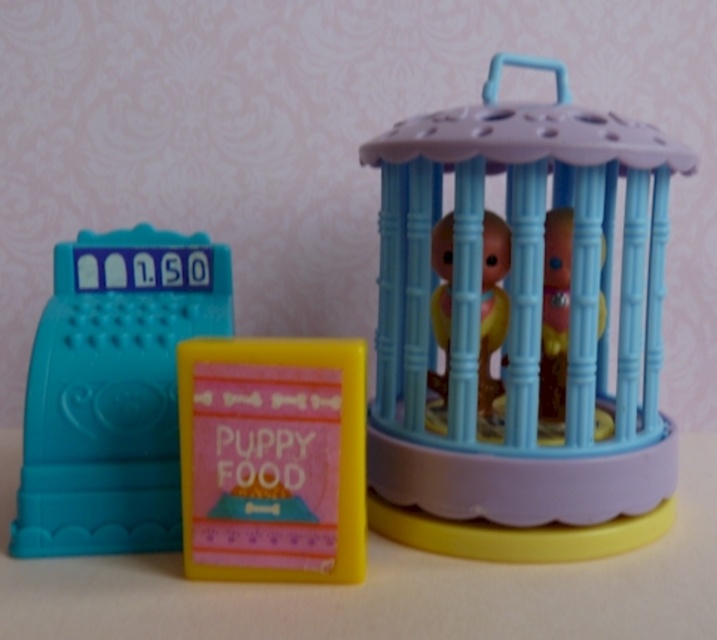
Question: Which of the following is the farthest from the observer?

Choices:
 (A) matte plastic cash register at left
 (B) pastel blue plastic birdcage at right

Answer: (A)

Question: Is matte plastic cash register at left closer to camera compared to yellow matte puppy food at center?

Choices:
 (A) yes
 (B) no

Answer: (B)

Question: Which object is the closest to the pastel blue plastic birdcage at right?

Choices:
 (A) yellow matte puppy food at center
 (B) matte plastic cash register at left

Answer: (A)

Question: Is pastel blue plastic birdcage at right below matte plastic cash register at left?

Choices:
 (A) yes
 (B) no

Answer: (B)

Question: Does pastel blue plastic birdcage at right appear over matte plastic cash register at left?

Choices:
 (A) no
 (B) yes

Answer: (B)

Question: Estimate the real-world distances between objects in this image. Which object is farther from the pastel blue plastic birdcage at right?

Choices:
 (A) matte plastic cash register at left
 (B) yellow matte puppy food at center

Answer: (A)